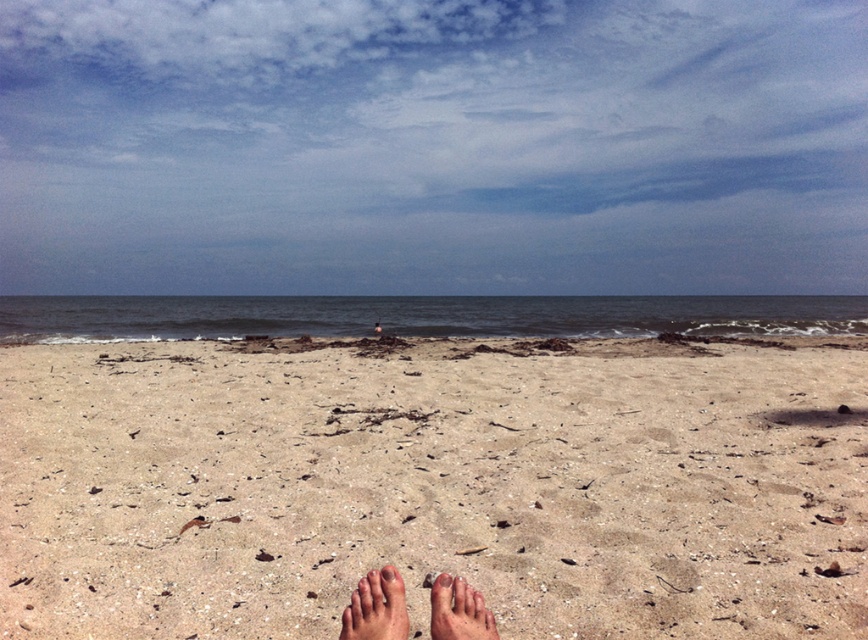
Question: Estimate the real-world distances between objects in this image. Which object is farther from the light beige sand at center?

Choices:
 (A) smooth tan foot at lower center
 (B) brown rough toe at lower center
 (C) light brown skin at lower center

Answer: (B)

Question: Where is skinny bare feet at lower center located in relation to light brown skin at lower center in the image?

Choices:
 (A) above
 (B) below

Answer: (B)

Question: Is light beige sand at center to the left of skinny bare feet at lower center from the viewer's perspective?

Choices:
 (A) yes
 (B) no

Answer: (A)

Question: Does skinny bare feet at lower center appear over smooth tan foot at lower center?

Choices:
 (A) yes
 (B) no

Answer: (A)

Question: Which point appears farthest from the camera in this image?

Choices:
 (A) (641, 365)
 (B) (481, 602)

Answer: (A)

Question: Which point is closer to the camera?

Choices:
 (A) smooth tan foot at lower center
 (B) skinny bare feet at lower center

Answer: (A)